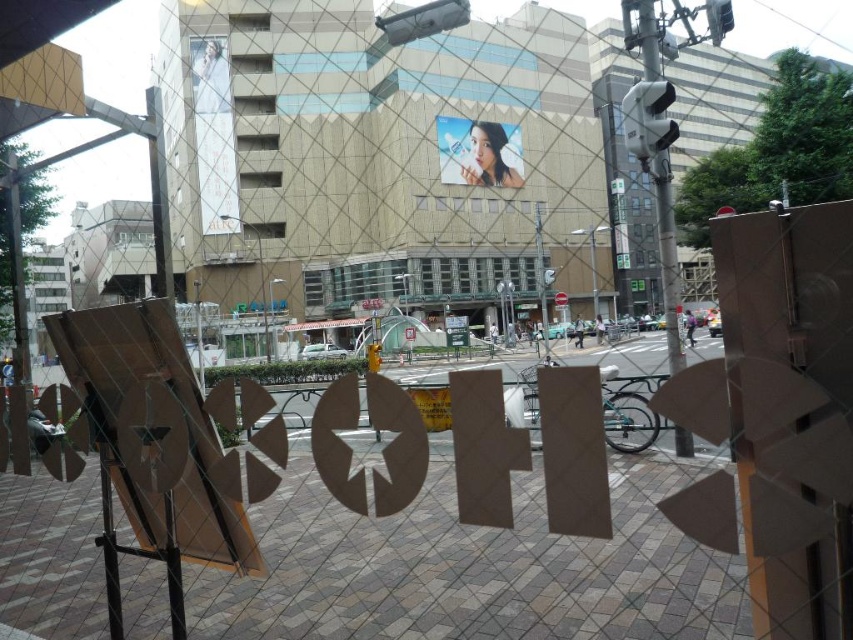
Does smooth glossy poster at center lie in front of white plastic traffic light at upper right?

That is False.

Is smooth glossy poster at center taller than white plastic traffic light at upper right?

No.

This screenshot has height=640, width=853. What do you see at coordinates (479, 152) in the screenshot? I see `smooth glossy poster at center` at bounding box center [479, 152].

I want to click on smooth glossy poster at center, so click(479, 152).

Between smooth glossy poster at center and metallic pole at center, which one appears on the left side from the viewer's perspective?

metallic pole at center is more to the left.

Who is more forward, (503,131) or (267,358)?

Positioned in front is point (267,358).

Identify the location of smooth glossy poster at center. The height and width of the screenshot is (640, 853). (479, 152).

Is white plastic traffic light at upper right taller than metallic pole at center?

Correct, white plastic traffic light at upper right is much taller as metallic pole at center.

Who is shorter, white plastic traffic light at upper right or metallic pole at center?

Standing shorter between the two is metallic pole at center.

Between point (659, 134) and point (265, 323), which one is positioned in front?

Point (659, 134)

Where is `white plastic traffic light at upper right`? Image resolution: width=853 pixels, height=640 pixels. white plastic traffic light at upper right is located at coordinates (648, 118).